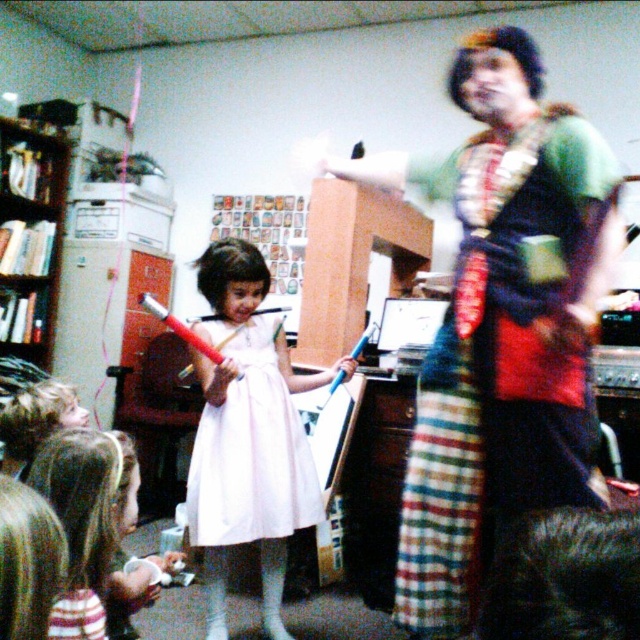
You are a photographer at the event and want to ensure both the green textured dress at center and the blonde hair at lower left are visible in the photo. Given their sizes, which object should you focus on to capture both without cropping?

The green textured dress at center is bigger than blonde hair at lower left, so you should focus on the green textured dress at center to ensure both are visible without cropping.